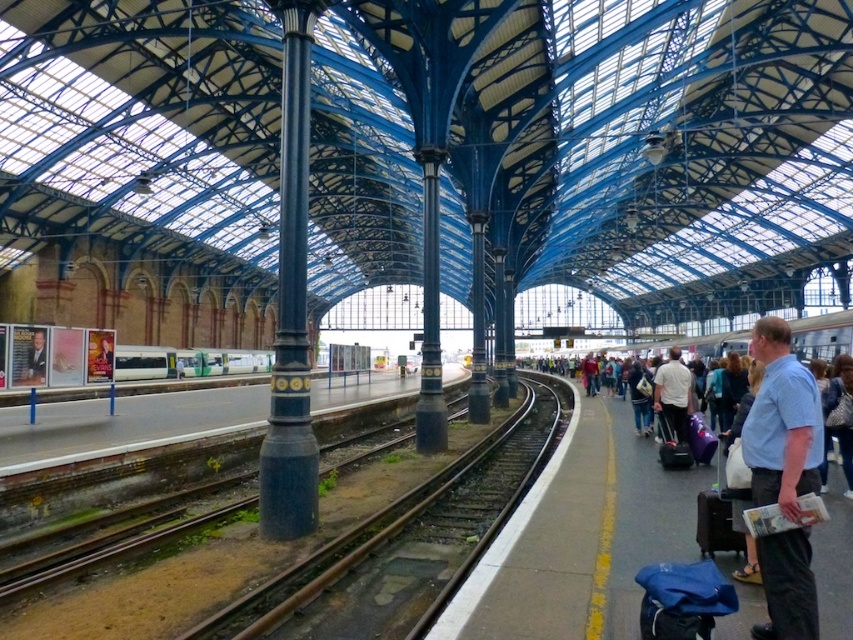
You are standing at the entrance of the train station and want to locate the polished dark blue column at center. According to the coordinates provided, where should you look to find it?

The polished dark blue column at center is located at coordinates point (291, 301).